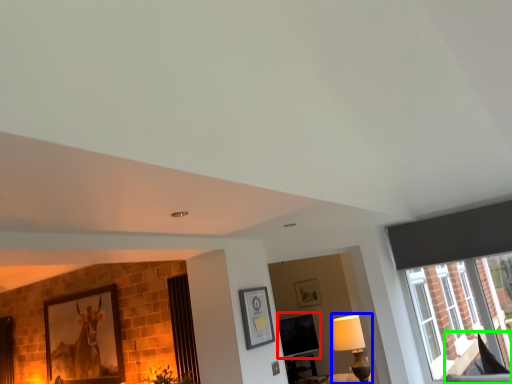
Question: Considering the real-world distances, which object is farthest from window screen (highlighted by a red box)? lamp (highlighted by a blue box) or swivel chair (highlighted by a green box)?

Choices:
 (A) lamp
 (B) swivel chair

Answer: (B)